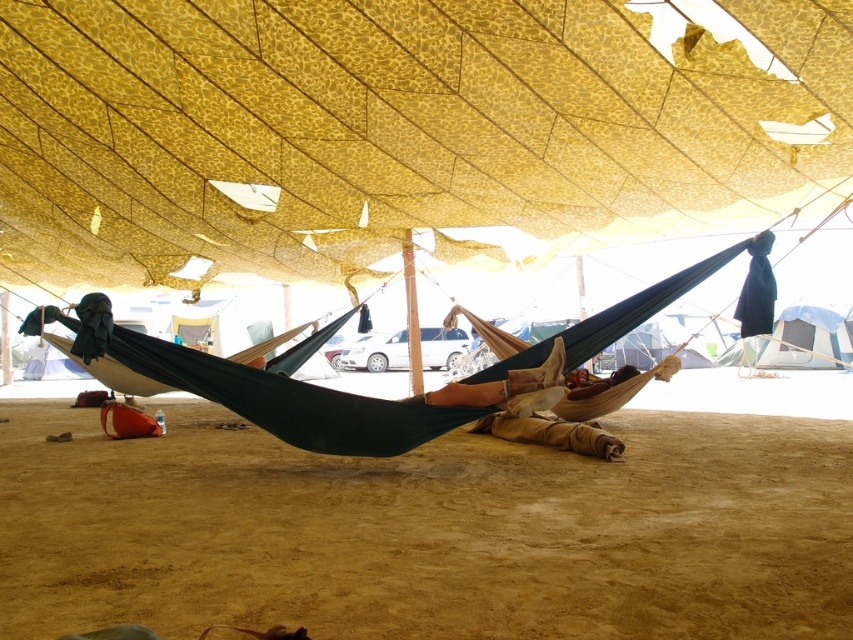
Question: Observing the image, what is the correct spatial positioning of sandy brown sand at lower center in reference to wooden chair at center?

Choices:
 (A) below
 (B) above

Answer: (A)

Question: Based on their relative distances, which object is farther from the yellow mesh canopy at center?

Choices:
 (A) sandy brown sand at lower center
 (B) wooden chair at center

Answer: (B)

Question: Based on their relative distances, which object is farther from the sandy brown sand at lower center?

Choices:
 (A) yellow mesh canopy at center
 (B) dark blue fabric hammock at center

Answer: (A)

Question: Is sandy brown sand at lower center smaller than white canvas tent at upper right?

Choices:
 (A) no
 (B) yes

Answer: (B)

Question: Which object is positioned farthest from the wooden chair at center?

Choices:
 (A) sandy brown sand at lower center
 (B) yellow mesh canopy at center
 (C) white canvas tent at upper right

Answer: (C)

Question: Can you confirm if yellow mesh canopy at center is positioned to the right of wooden chair at center?

Choices:
 (A) yes
 (B) no

Answer: (B)